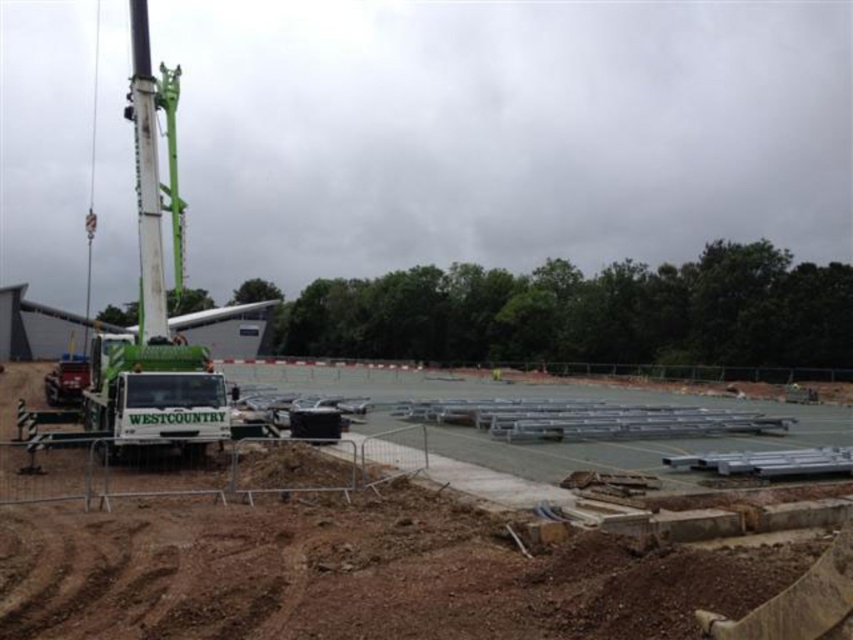
You are a delivery driver who needs to back up your truck to the loading dock. The white metallic scaffolding at center and the green matte trailer truck at lower left are in your way. Which object should you move first to clear a path?

You should move the green matte trailer truck at lower left first because the white metallic scaffolding at center is to the right of it, so moving the truck will allow access to the scaffolding.

You are standing at the construction site and want to reach the point marked as point (747, 573). Considering the distance between you and that point is 92.59 feet, can you estimate how many steps it would take to walk there if each of your steps is about 2.5 feet long?

The distance between you and point (747, 573) is 92.59 feet. If each step is 2.5 feet, dividing 92.59 by 2.5 gives approximately 37 steps. Therefore, it would take around 37 steps to walk to point (747, 573).

You are a construction worker who needs to determine if the white metallic scaffolding at center can fit under the green matte trailer truck at lower left without any modifications. Can it pass under the truck?

The white metallic scaffolding at center has a lesser height compared to the green matte trailer truck at lower left, so it can pass under the truck without any issues.